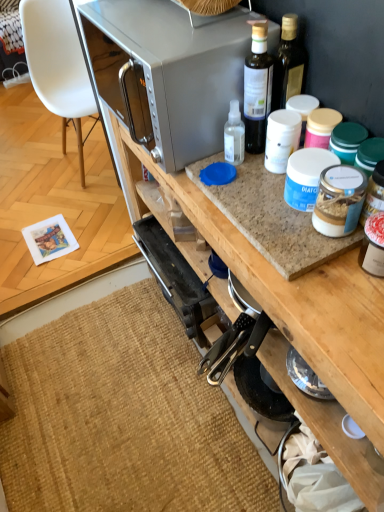
At what (x,y) coordinates should I click in order to perform the action: click on free space below burlap mat at lower left (from a real-world perspective). Please return your answer as a coordinate pair (x, y). The width and height of the screenshot is (384, 512). Looking at the image, I should click on (118, 406).